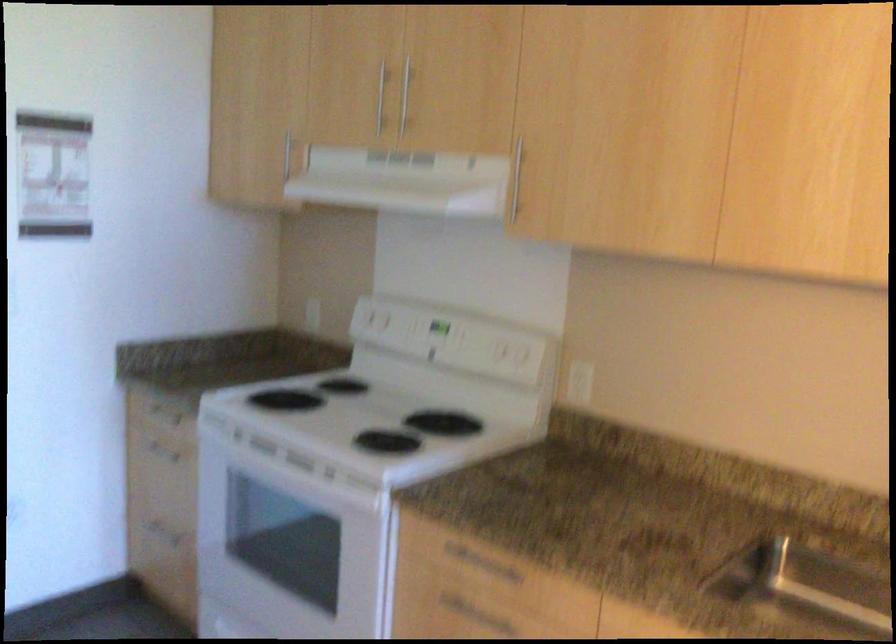
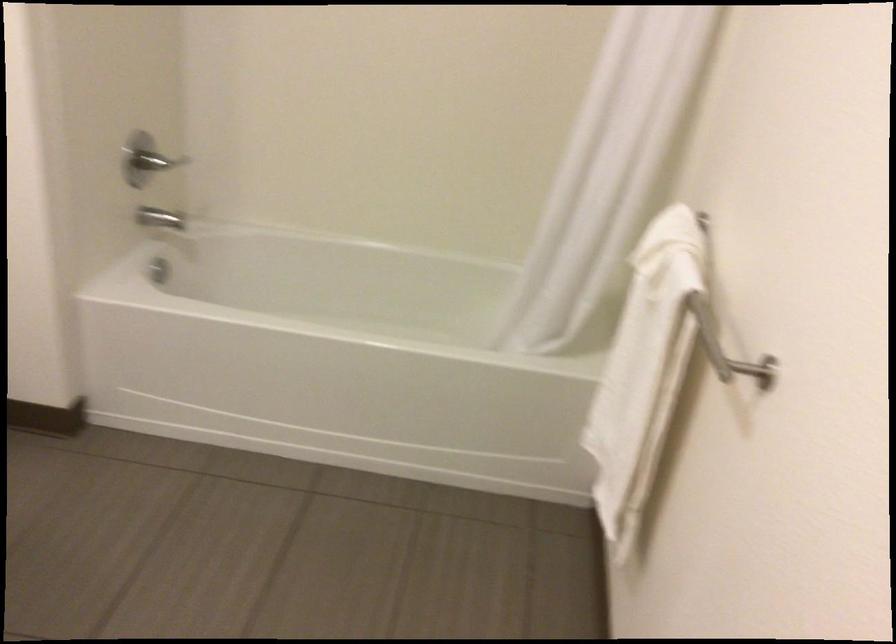
The first image is from the beginning of the video and the second image is from the end. How did the camera likely rotate when shooting the video?

The camera rotated toward left-down.